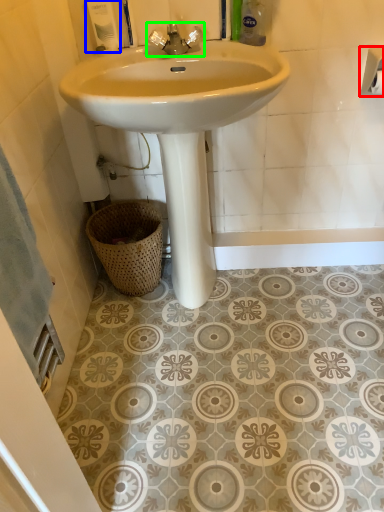
Question: Which object is positioned farthest from toilet paper (highlighted by a red box)? Select from toiletry (highlighted by a blue box) and tap (highlighted by a green box).

Choices:
 (A) toiletry
 (B) tap

Answer: (A)